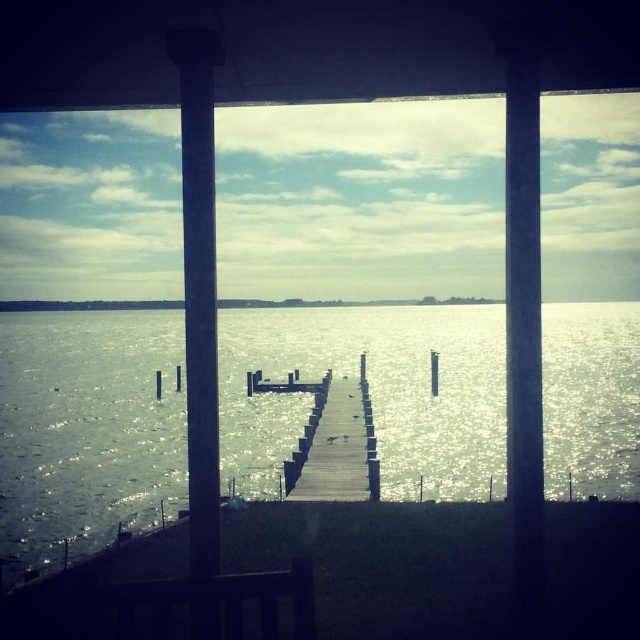
Which is behind, point (198, 554) or point (342, 410)?

The point (342, 410) is behind.

Between smooth concrete pillar at center and wooden dock at center, which one appears on the right side from the viewer's perspective?

Positioned to the right is wooden dock at center.

Measure the distance between smooth concrete pillar at center and camera.

5.94 meters

The height and width of the screenshot is (640, 640). What are the coordinates of `smooth concrete pillar at center` in the screenshot? It's located at (198, 285).

Is glistening silver water at center to the right of wooden dock at center from the viewer's perspective?

Correct, you'll find glistening silver water at center to the right of wooden dock at center.

Can you confirm if glistening silver water at center is thinner than wooden dock at center?

No, glistening silver water at center is not thinner than wooden dock at center.

Which is behind, point (384, 428) or point (310, 472)?

Point (384, 428)

Locate an element on the screen. glistening silver water at center is located at coordinates (371, 394).

Does glistening silver water at center have a greater height compared to smooth concrete pillar at center?

Yes.

Who is shorter, glistening silver water at center or smooth concrete pillar at center?

smooth concrete pillar at center is shorter.

Is point (84, 506) behind point (198, 109)?

Yes, it is behind point (198, 109).

This screenshot has height=640, width=640. I want to click on glistening silver water at center, so click(371, 394).